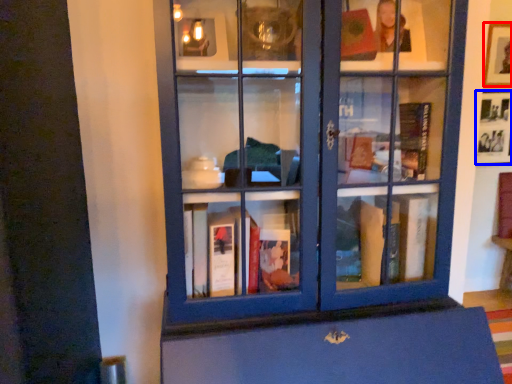
Question: Among these objects, which one is farthest to the camera, picture frame (highlighted by a red box) or picture frame (highlighted by a blue box)?

Choices:
 (A) picture frame
 (B) picture frame

Answer: (B)